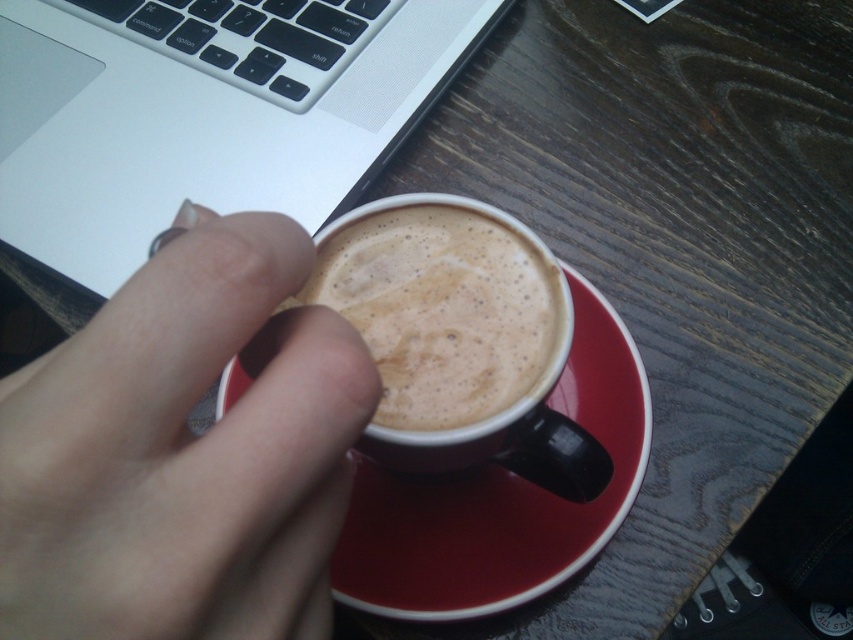
Between smooth skin hand at upper center and red matte saucer at center, which one is positioned higher?

smooth skin hand at upper center is above.

From the picture: Is smooth skin hand at upper center above red matte saucer at center?

Indeed, smooth skin hand at upper center is positioned over red matte saucer at center.

This screenshot has height=640, width=853. What do you see at coordinates (183, 451) in the screenshot?
I see `smooth skin hand at upper center` at bounding box center [183, 451].

Where is `smooth skin hand at upper center`? The width and height of the screenshot is (853, 640). smooth skin hand at upper center is located at coordinates (183, 451).

Can you confirm if silver metallic laptop at upper left is smaller than smooth matte coffee cup at center?

No.

Can you confirm if silver metallic laptop at upper left is shorter than smooth matte coffee cup at center?

Incorrect, silver metallic laptop at upper left's height does not fall short of smooth matte coffee cup at center's.

I want to click on silver metallic laptop at upper left, so click(206, 113).

Does red matte saucer at center appear on the left side of smooth matte coffee cup at center?

In fact, red matte saucer at center is to the right of smooth matte coffee cup at center.

Which is below, red matte saucer at center or smooth matte coffee cup at center?

Positioned lower is red matte saucer at center.

Who is more forward, (x=529, y=493) or (x=418, y=266)?

Point (x=418, y=266) is more forward.

At what (x,y) coordinates should I click in order to perform the action: click on red matte saucer at center. Please return your answer as a coordinate pair (x, y). Looking at the image, I should click on (500, 499).